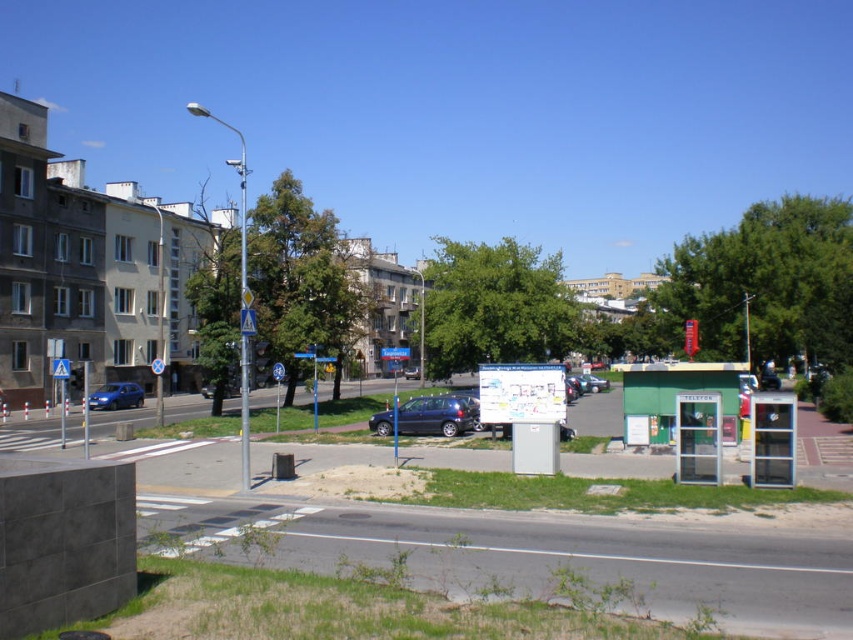
In the scene shown: Between metallic blue hatchback at center and metallic blue sedan at lower left, which one has less height?

With less height is metallic blue sedan at lower left.

Which is in front, point (450, 413) or point (129, 404)?

Point (450, 413) is more forward.

The width and height of the screenshot is (853, 640). Identify the location of metallic blue hatchback at center. (427, 417).

What do you see at coordinates (427, 417) in the screenshot? I see `metallic blue hatchback at center` at bounding box center [427, 417].

Is point (387, 432) farther from viewer compared to point (601, 385)?

No, (387, 432) is closer to viewer.

Measure the distance between point (468, 397) and camera.

A distance of 33.72 meters exists between point (468, 397) and camera.

At what (x,y) coordinates should I click in order to perform the action: click on metallic blue hatchback at center. Please return your answer as a coordinate pair (x, y). This screenshot has height=640, width=853. Looking at the image, I should click on (427, 417).

Which is above, metallic blue sedan at lower left or metallic silver sedan at center?

metallic silver sedan at center

Is metallic blue sedan at lower left wider than metallic silver sedan at center?

No, metallic blue sedan at lower left is not wider than metallic silver sedan at center.

Is point (119, 384) positioned before point (585, 381)?

Yes, it is in front of point (585, 381).

The width and height of the screenshot is (853, 640). What are the coordinates of `metallic blue sedan at lower left` in the screenshot? It's located at (115, 396).